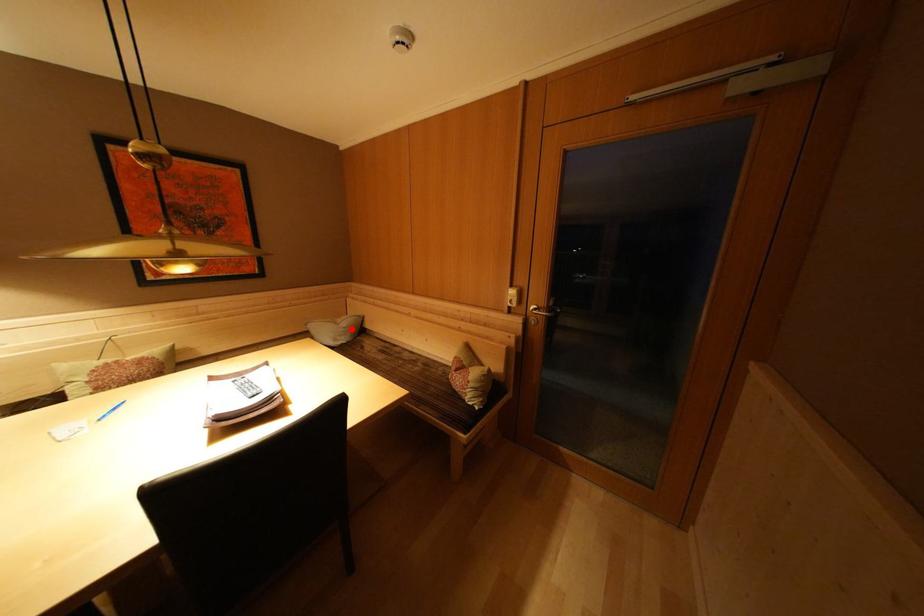
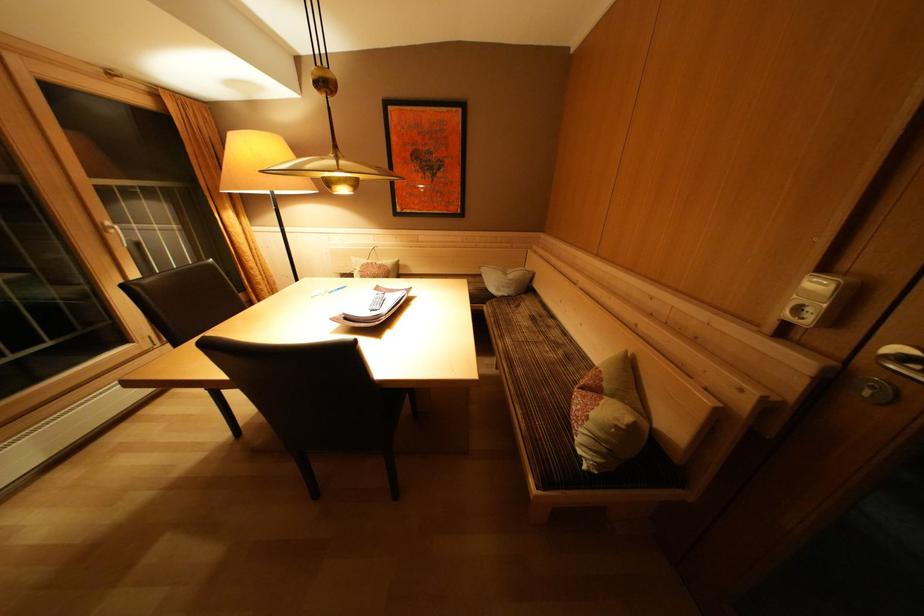
Locate, in the second image, the point that corresponds to the highlighted location in the first image.

(517, 281)